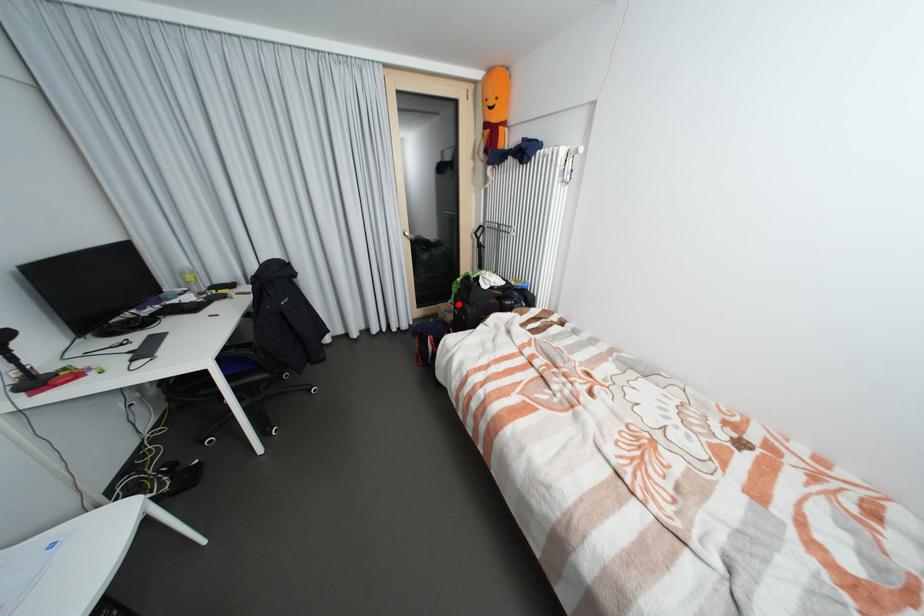
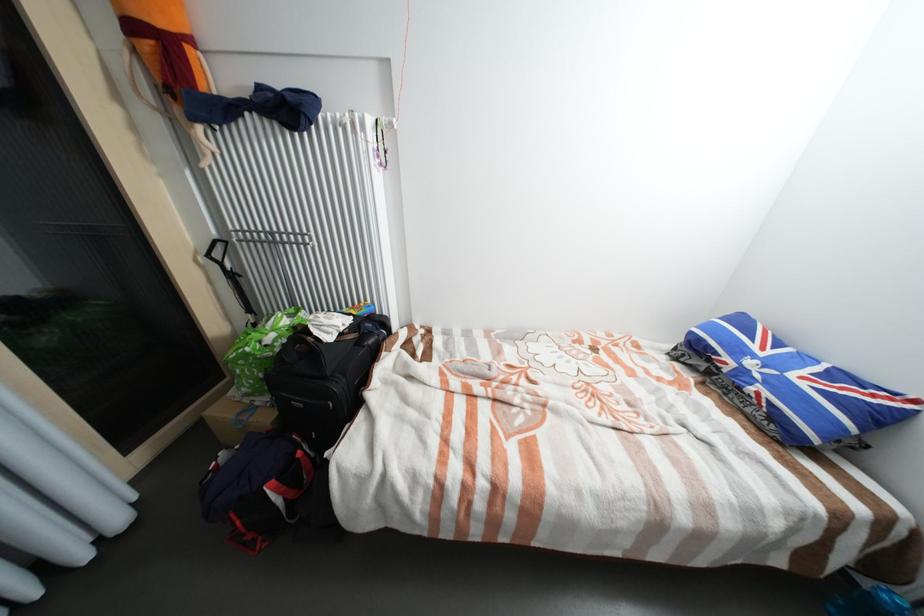
Find the pixel in the second image that matches the highlighted location in the first image.

(253, 395)